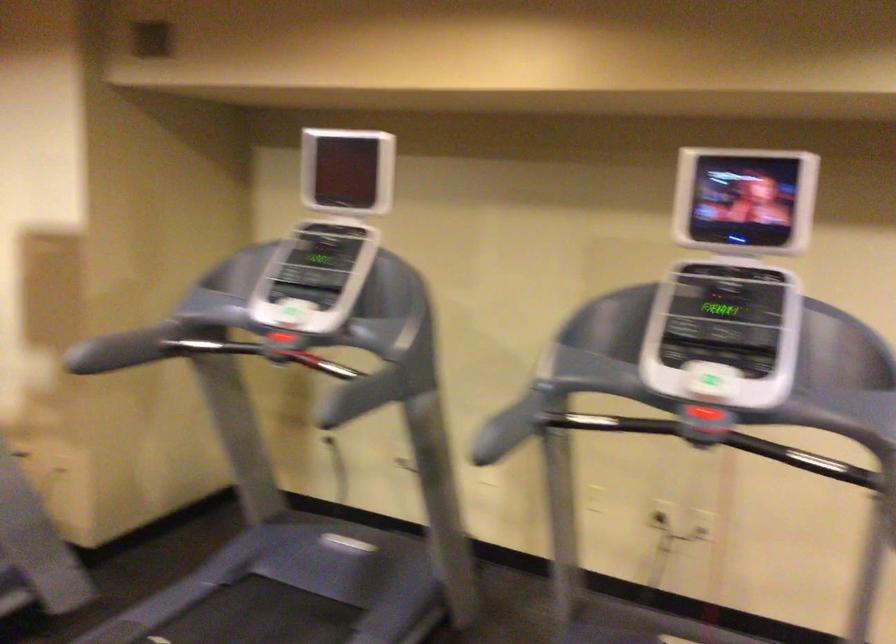
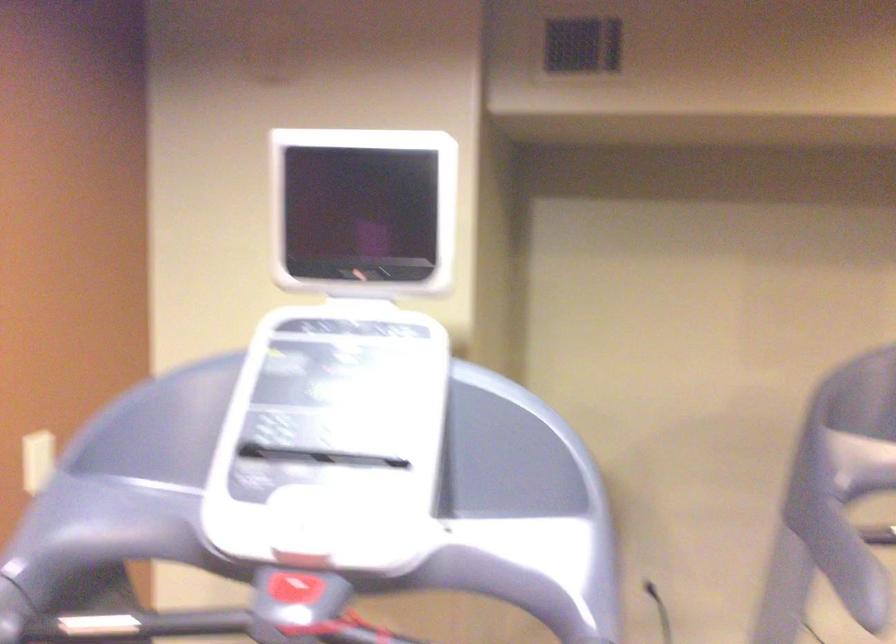
The images are taken continuously from a first-person perspective. In which direction are you moving?

The movement direction of the cameraman is left, forward.